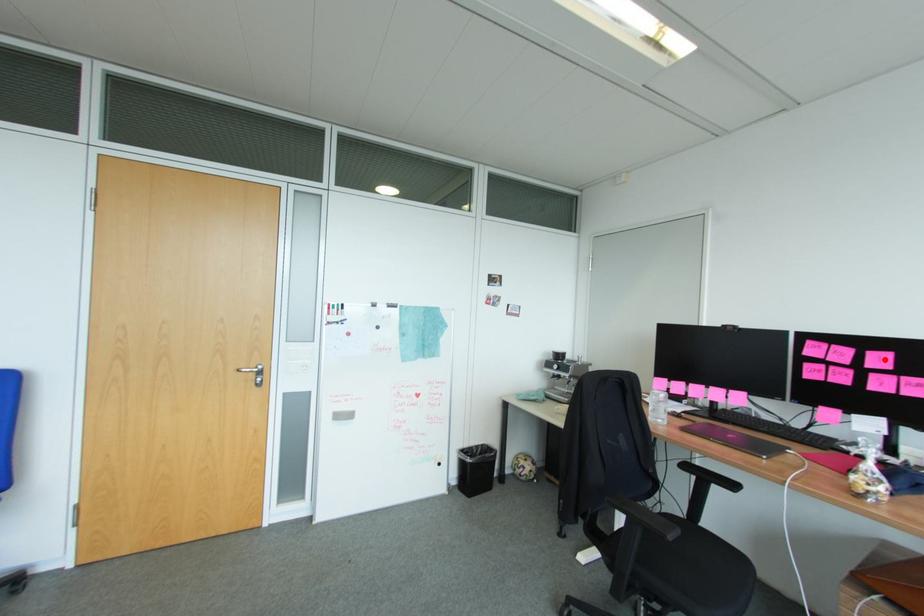
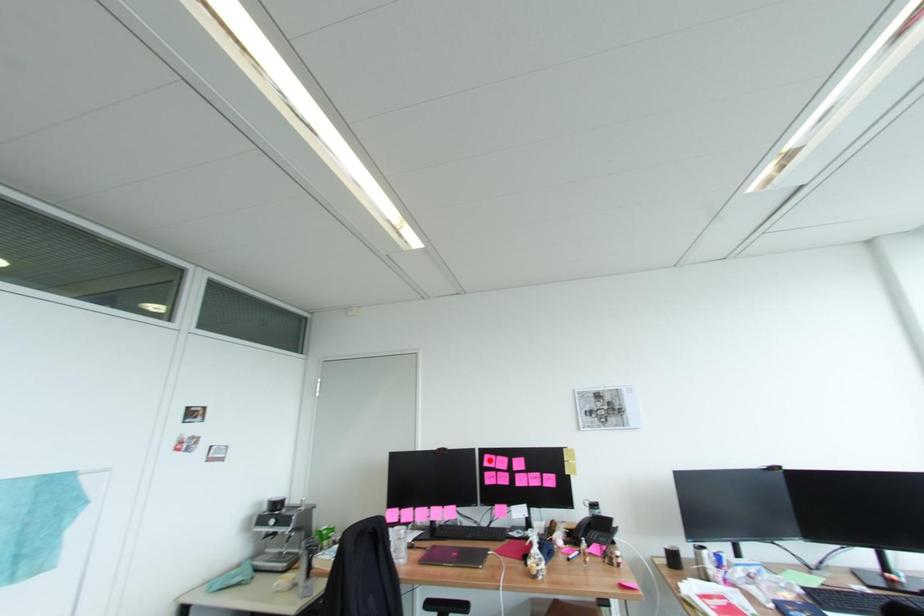
Consider the image. I am providing you with two images of the same scene from different viewpoints. A red point is marked on the first image and another point is marked on the second image. Is the marked point in image1 the same physical position as the marked point in image2?

No